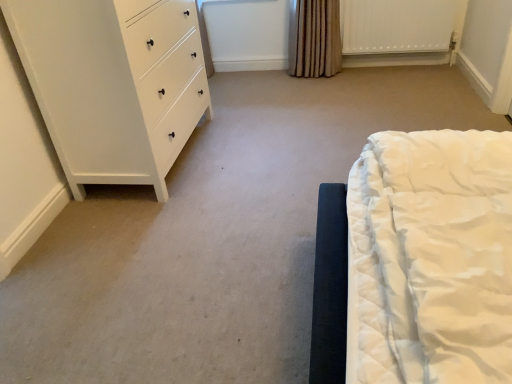
Question: Is brown textured curtain at upper center not near white textured radiator at upper right?

Choices:
 (A) yes
 (B) no

Answer: (B)

Question: Can you confirm if brown textured curtain at upper center is taller than white textured radiator at upper right?

Choices:
 (A) yes
 (B) no

Answer: (A)

Question: From a real-world perspective, does brown textured curtain at upper center stand above white textured radiator at upper right?

Choices:
 (A) no
 (B) yes

Answer: (B)

Question: Considering the relative sizes of brown textured curtain at upper center and white textured radiator at upper right in the image provided, is brown textured curtain at upper center smaller than white textured radiator at upper right?

Choices:
 (A) no
 (B) yes

Answer: (A)

Question: Considering the relative positions of brown textured curtain at upper center and white textured radiator at upper right in the image provided, is brown textured curtain at upper center to the right of white textured radiator at upper right from the viewer's perspective?

Choices:
 (A) yes
 (B) no

Answer: (B)

Question: Can you confirm if brown textured curtain at upper center is bigger than white textured radiator at upper right?

Choices:
 (A) yes
 (B) no

Answer: (A)

Question: Is white matte chest of drawers at left shorter than brown textured curtain at upper center?

Choices:
 (A) yes
 (B) no

Answer: (B)

Question: Can you confirm if white matte chest of drawers at left is taller than brown textured curtain at upper center?

Choices:
 (A) no
 (B) yes

Answer: (B)

Question: Is white matte chest of drawers at left looking in the opposite direction of brown textured curtain at upper center?

Choices:
 (A) yes
 (B) no

Answer: (B)

Question: Is white matte chest of drawers at left behind brown textured curtain at upper center?

Choices:
 (A) yes
 (B) no

Answer: (B)

Question: From a real-world perspective, is white matte chest of drawers at left located beneath brown textured curtain at upper center?

Choices:
 (A) no
 (B) yes

Answer: (A)

Question: Is white matte chest of drawers at left touching brown textured curtain at upper center?

Choices:
 (A) no
 (B) yes

Answer: (A)

Question: Is white matte chest of drawers at left facing towards white textured radiator at upper right?

Choices:
 (A) yes
 (B) no

Answer: (B)